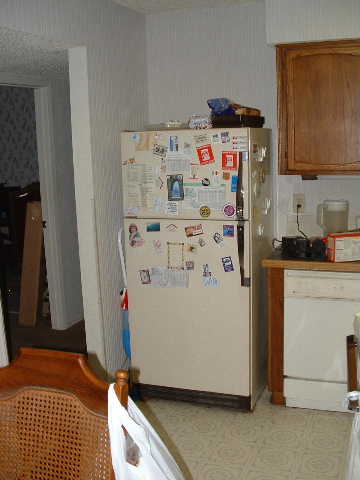
Find the location of a particular element. The height and width of the screenshot is (480, 360). wooden doorway is located at coordinates (42, 121).